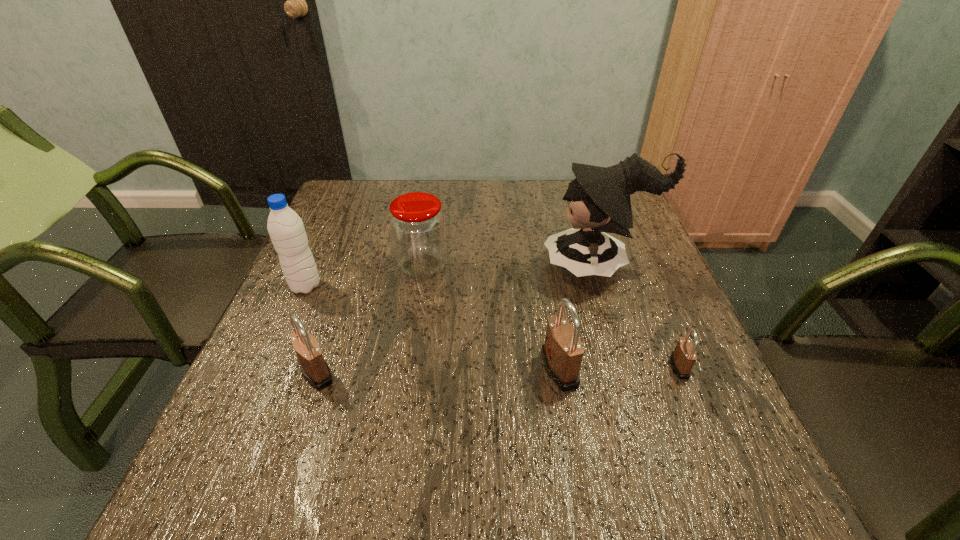
Please point a spot to place another padlock for symmetrical spacing. Please provide its 2D coordinates. Your answer should be formatted as a tuple, i.e. [(x, y)], where the tuple contains the x and y coordinates of a point satisfying the conditions above.

[(438, 370)]